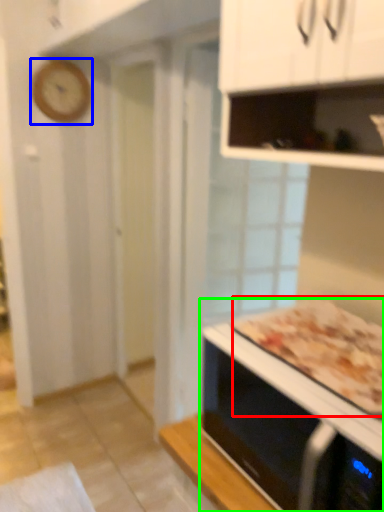
Question: Considering the real-world distances, which object is farthest from pizza (highlighted by a red box)? clock (highlighted by a blue box) or microwave oven (highlighted by a green box)?

Choices:
 (A) clock
 (B) microwave oven

Answer: (A)